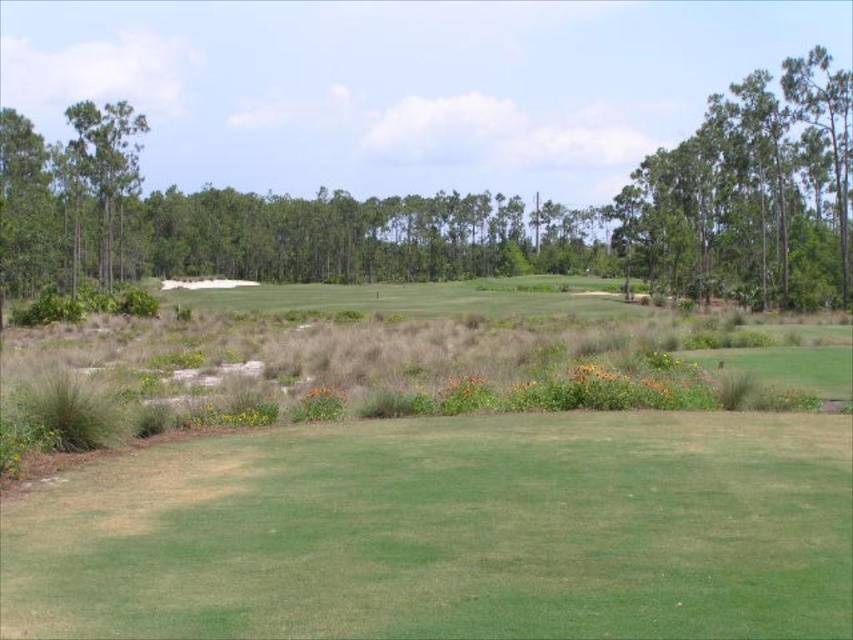
Does green grassy field at center have a lesser width compared to green leafy trees at upper right?

Indeed, green grassy field at center has a lesser width compared to green leafy trees at upper right.

Does green grassy field at center have a greater width compared to green leafy trees at upper right?

No.

Which is behind, point (252, 472) or point (814, 74)?

The point (814, 74) is behind.

This screenshot has width=853, height=640. Identify the location of green grassy field at center. (447, 531).

Who is more forward, (439, 237) or (105, 250)?

Point (105, 250) is more forward.

The image size is (853, 640). Describe the element at coordinates (463, 212) in the screenshot. I see `green leafy tree at upper center` at that location.

Between point (759, 96) and point (117, 220), which one is positioned behind?

The point (117, 220) is behind.

Where is `green leafy tree at upper center`? This screenshot has width=853, height=640. green leafy tree at upper center is located at coordinates (463, 212).

The height and width of the screenshot is (640, 853). Describe the element at coordinates (447, 531) in the screenshot. I see `green grassy field at center` at that location.

Is green grassy field at center taller than green leafy tree at left?

No.

Does point (752, 609) come closer to viewer compared to point (113, 268)?

Yes.

Locate an element on the screen. This screenshot has width=853, height=640. green grassy field at center is located at coordinates (447, 531).